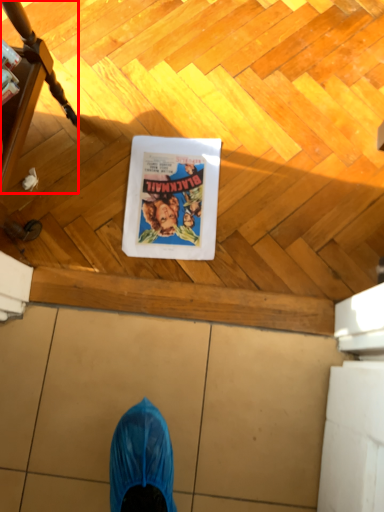
Question: Considering the relative positions of furniture (annotated by the red box) and comic book character in the image provided, where is furniture (annotated by the red box) located with respect to the staircase?

Choices:
 (A) right
 (B) left

Answer: (B)